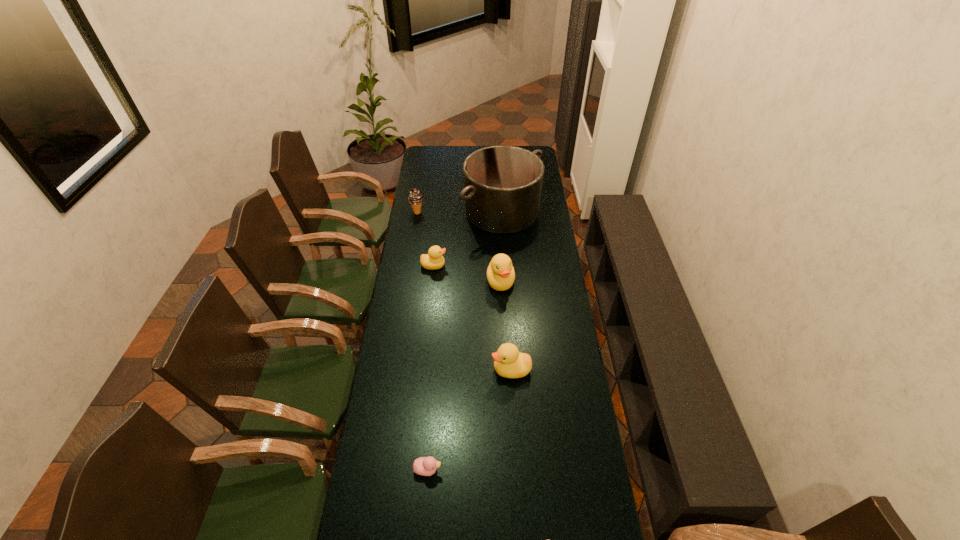
The width and height of the screenshot is (960, 540). I want to click on the third closest object relative to the farther pink duckling, so click(x=500, y=273).

I want to click on duckling that is the second closest one to the tallest duckling, so click(508, 362).

Locate which duckling is the fourth closest to the tallest duckling. Please provide its 2D coordinates. Your answer should be formatted as a tuple, i.e. [(x, y)], where the tuple contains the x and y coordinates of a point satisfying the conditions above.

[(548, 539)]

Identify which yellow duckling is located as the second nearest to the nearest object. Please provide its 2D coordinates. Your answer should be formatted as a tuple, i.e. [(x, y)], where the tuple contains the x and y coordinates of a point satisfying the conditions above.

[(500, 273)]

This screenshot has height=540, width=960. I want to click on yellow duckling that is the third closest to the pan, so click(x=508, y=362).